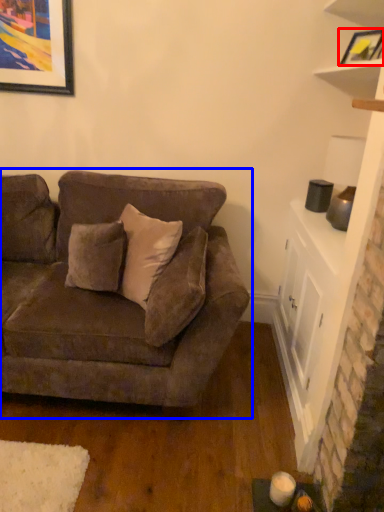
Question: Among these objects, which one is nearest to the camera, picture frame (highlighted by a red box) or studio couch (highlighted by a blue box)?

Choices:
 (A) picture frame
 (B) studio couch

Answer: (B)